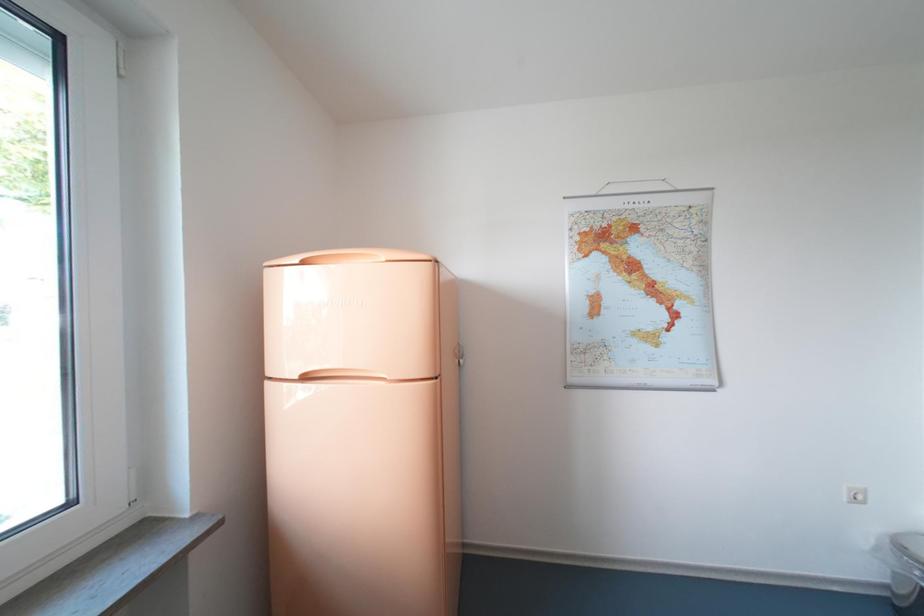
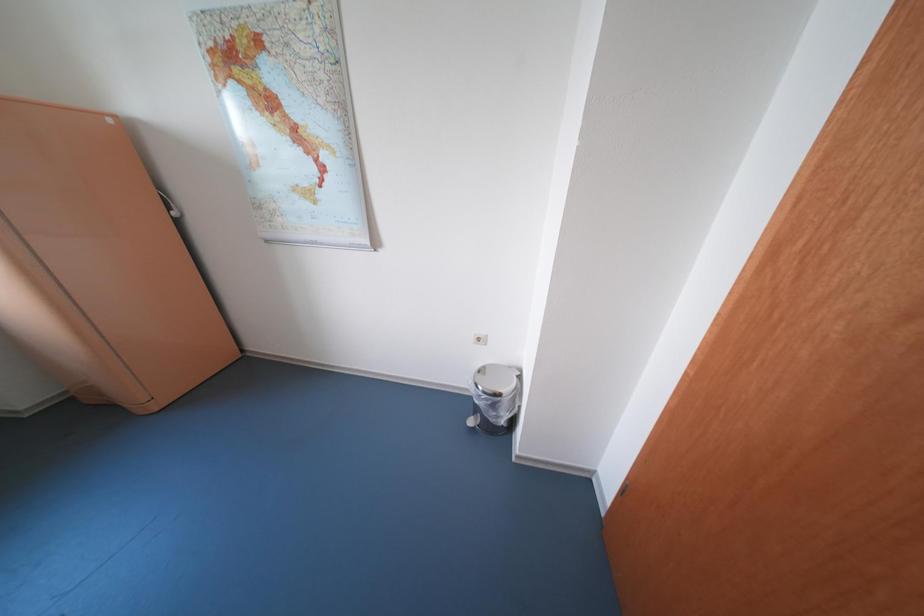
Question: The images are taken continuously from a first-person perspective. In which direction are you moving?

Choices:
 (A) Left
 (B) Right
 (C) Forward
 (D) Backward

Answer: (B)